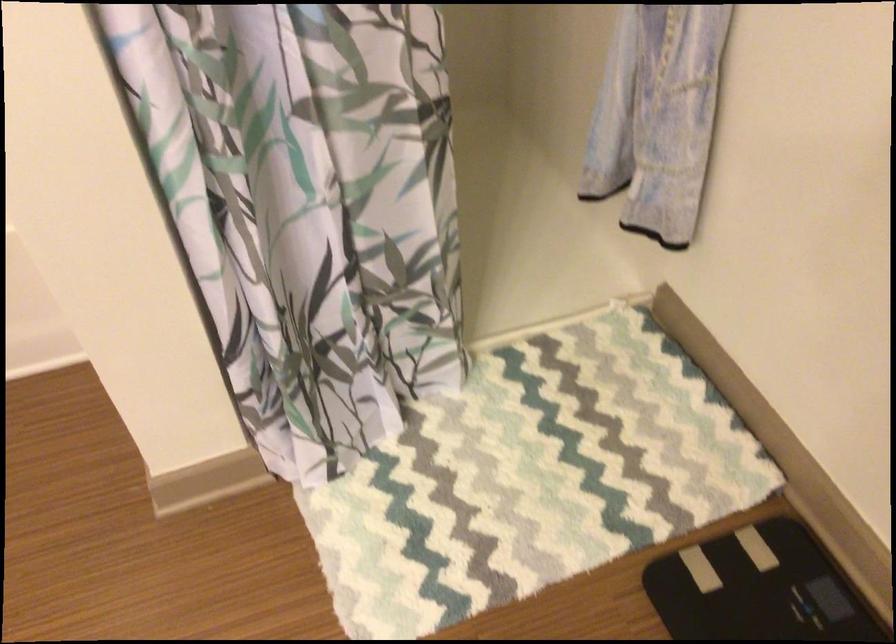
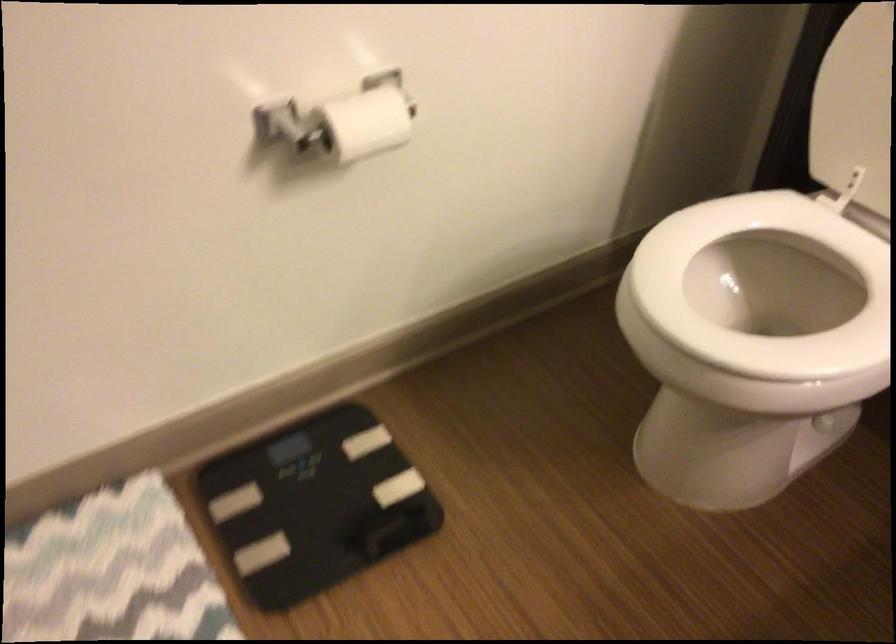
Based on the continuous images, in which direction is the camera rotating?

The rotation direction of the camera is right-down.